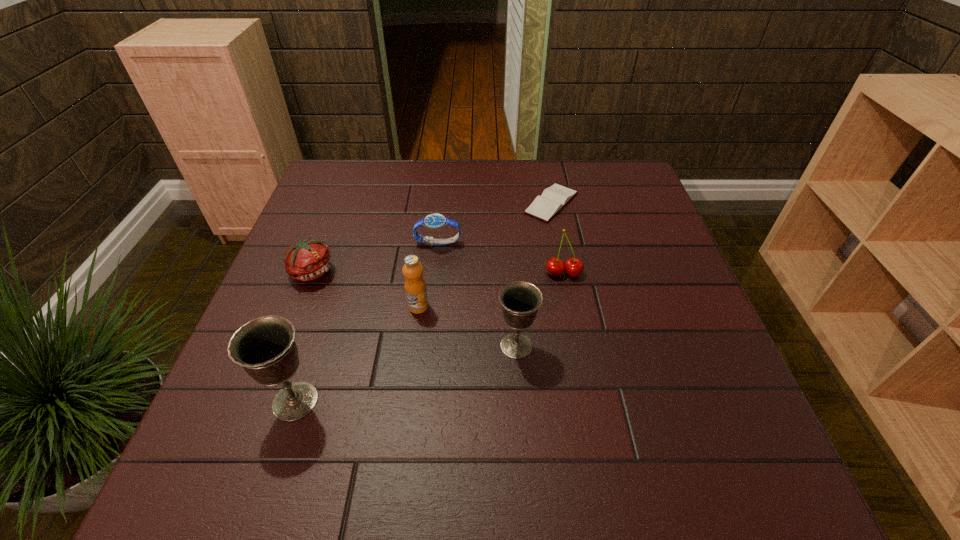
The height and width of the screenshot is (540, 960). In order to click on object that stands as the fifth closest to the left chalice in this screenshot , I will do `click(573, 266)`.

Locate an element on the screen. free space that satisfies the following two spatial constraints: 1. on the front label of the orange juice; 2. on the left side of the right chalice is located at coordinates (413, 346).

Identify the location of vacant area in the image that satisfies the following two spatial constraints: 1. on the back side of the sixth tallest object; 2. on the left side of the taller chalice. (348, 242).